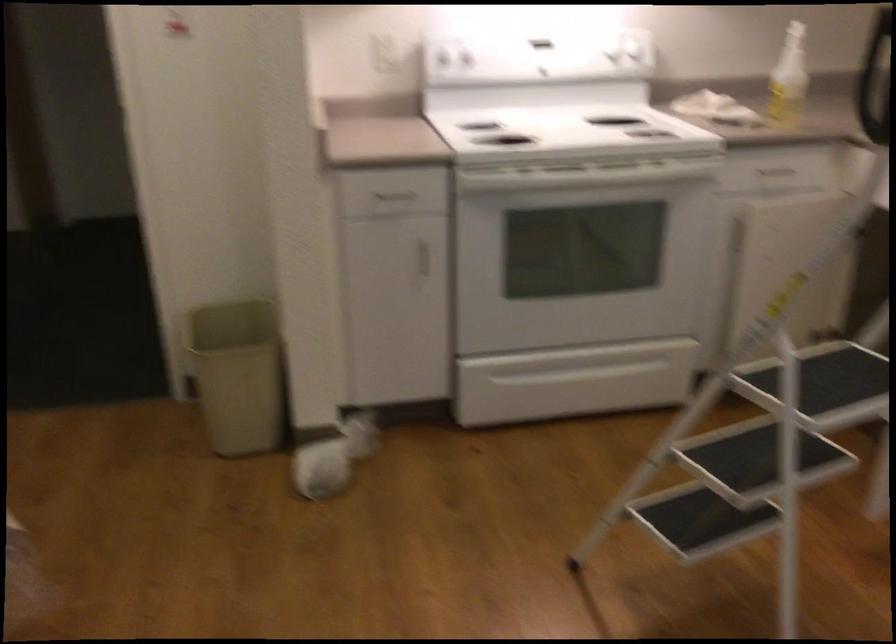
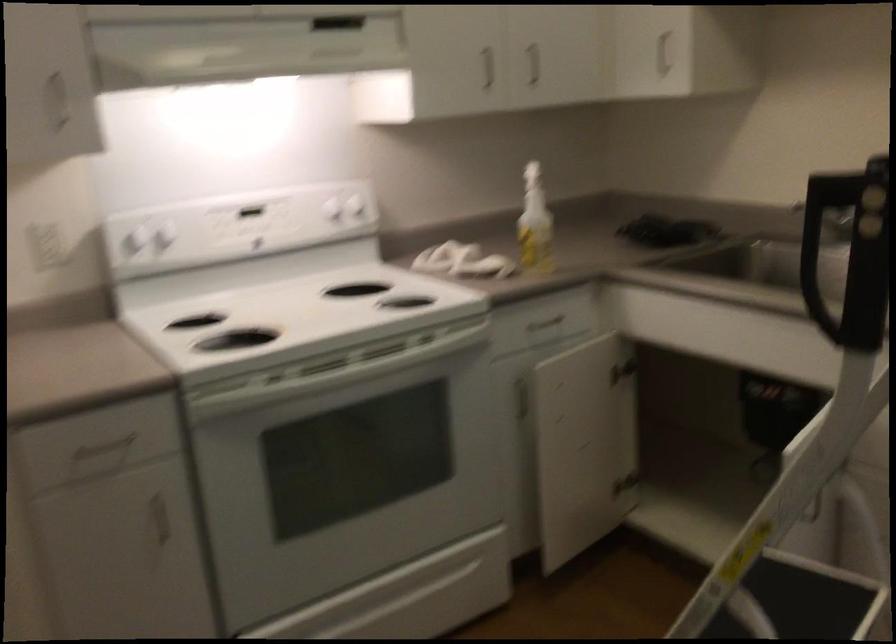
The point at (x=391, y=194) is marked in the first image. Where is the corresponding point in the second image?

(102, 448)